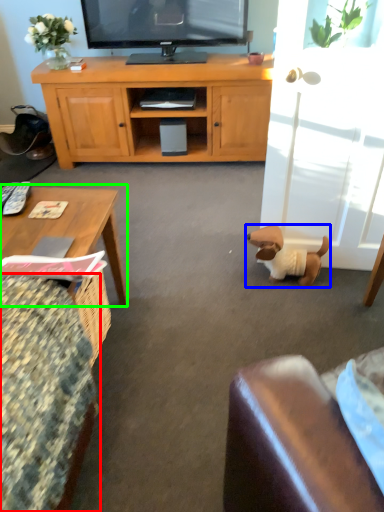
Question: Which object is positioned closest to chair (highlighted by a red box)? Select from dog (highlighted by a blue box) and coffee table (highlighted by a green box).

Choices:
 (A) dog
 (B) coffee table

Answer: (B)